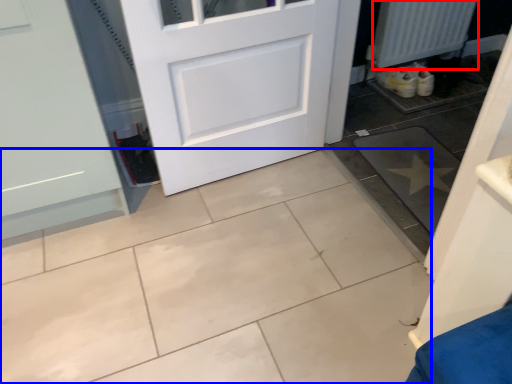
Question: Among these objects, which one is nearest to the camera, radiator (highlighted by a red box) or ceramic tile (highlighted by a blue box)?

Choices:
 (A) radiator
 (B) ceramic tile

Answer: (B)